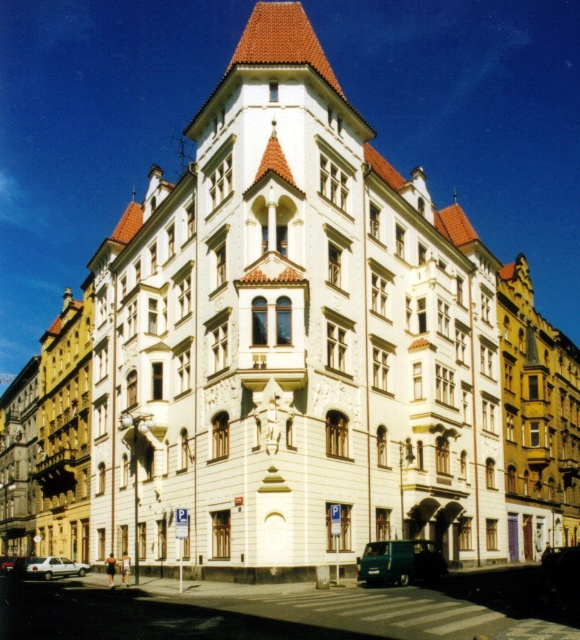
Can you confirm if white matte car at lower left is shorter than silver metallic car at lower left?

Yes, white matte car at lower left is shorter than silver metallic car at lower left.

Is white matte car at lower left above silver metallic car at lower left?

Yes, white matte car at lower left is above silver metallic car at lower left.

Where is `white matte car at lower left`? white matte car at lower left is located at coordinates (55, 566).

Can you confirm if green matte van at lower center is positioned below white matte car at lower left?

Incorrect, green matte van at lower center is not positioned below white matte car at lower left.

Is green matte van at lower center further to the viewer compared to white matte car at lower left?

No.

Based on the photo, who is more forward, (x=371, y=570) or (x=48, y=564)?

Point (x=371, y=570) is more forward.

In order to click on green matte van at lower center in this screenshot , I will do `click(400, 563)`.

How much distance is there between green matte van at lower center and silver metallic car at lower left?

green matte van at lower center is 40.42 meters away from silver metallic car at lower left.

Is green matte van at lower center positioned behind silver metallic car at lower left?

No, green matte van at lower center is closer to the viewer.

Where is `green matte van at lower center`? This screenshot has height=640, width=580. green matte van at lower center is located at coordinates (400, 563).

Locate an element on the screen. This screenshot has height=640, width=580. green matte van at lower center is located at coordinates (400, 563).